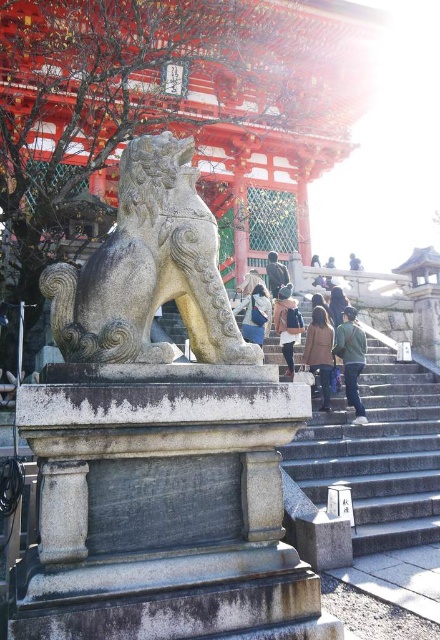
Question: Which point appears farthest from the camera in this image?

Choices:
 (A) (289, 470)
 (B) (304, 355)

Answer: (B)

Question: Is dark brown leather backpack at center further to camera compared to blue denim jeans at center?

Choices:
 (A) yes
 (B) no

Answer: (B)

Question: Which of the following is the closest to the observer?

Choices:
 (A) blue denim jeans at center
 (B) granite statue at left
 (C) green fabric jacket at center
 (D) gray stone stairs at center

Answer: (B)

Question: Is green fabric jacket at center bigger than blue denim jeans at center?

Choices:
 (A) no
 (B) yes

Answer: (B)

Question: Which point appears farthest from the camera in this image?

Choices:
 (A) (132, 176)
 (B) (242, 308)
 (C) (332, 328)
 (D) (270, 259)

Answer: (D)

Question: In this image, where is granite statue at left located relative to blue denim jeans at center?

Choices:
 (A) right
 (B) left

Answer: (B)